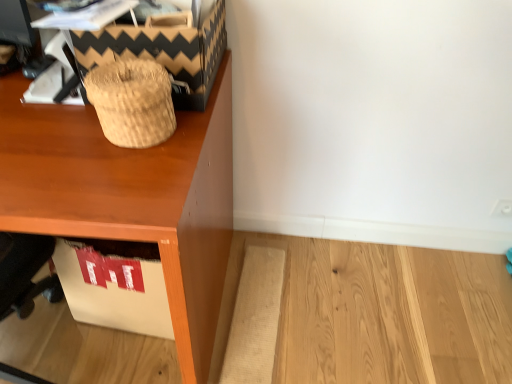
You are a GUI agent. You are given a task and a screenshot of the screen. Output one action in this format:
    pyautogui.click(x=<x>, y=<y>)
    Task: Click on the vacant area that lies between woven straw basket at upper left and brown woven basket at upper left
    The width and height of the screenshot is (512, 384).
    Given the screenshot: What is the action you would take?
    pyautogui.click(x=99, y=128)